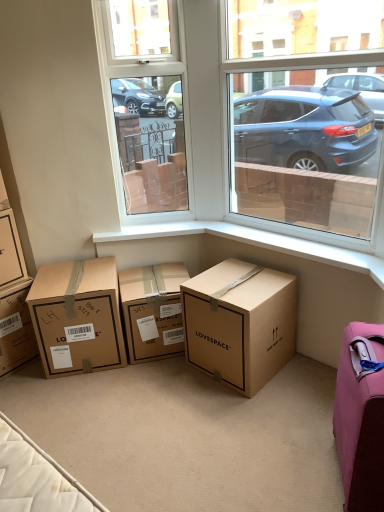
Question: Is brown cardboard box at lower left, which is counted as the 5th box, starting from the right, wider or thinner than brown cardboard box at left, which ranks as the second box in left-to-right order?

Choices:
 (A) thin
 (B) wide

Answer: (B)

Question: From a real-world perspective, is brown cardboard box at lower left, the 1th box positioned from the left, above or below brown cardboard box at left, arranged as the 4th box when viewed from the right?

Choices:
 (A) above
 (B) below

Answer: (B)

Question: Which object is positioned closest to the brown cardboard box at lower left, the 1th box positioned from the left?

Choices:
 (A) transparent glass window at center, the first window screen from the left
 (B) brown cardboard box at lower left, which is counted as the 3th box, starting from the left
 (C) white plastic window sill at lower right
 (D) transparent glass window at upper right, the 1th window screen in the right-to-left sequence
 (E) pink fabric suitcase at lower right

Answer: (B)

Question: Which is farther from the brown cardboard box at left, arranged as the 4th box when viewed from the right?

Choices:
 (A) transparent glass window at center, the first window screen from the left
 (B) white plastic window sill at lower right
 (C) brown cardboard box at lower center, which is the 5th box in left-to-right order
 (D) brown cardboard box at lower left, which is counted as the 5th box, starting from the right
 (E) brown cardboard box at lower left, which is counted as the 3th box, starting from the left

Answer: (C)